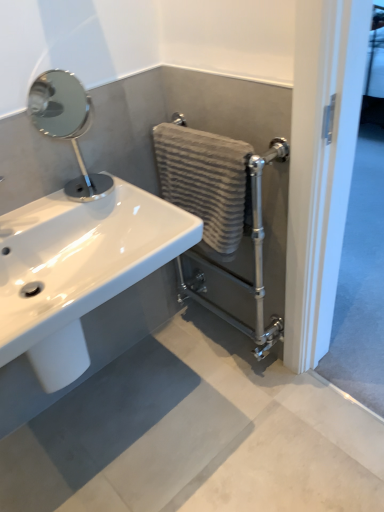
I want to click on vacant space in textured beige towel at center-right (from a real-world perspective), so click(x=216, y=349).